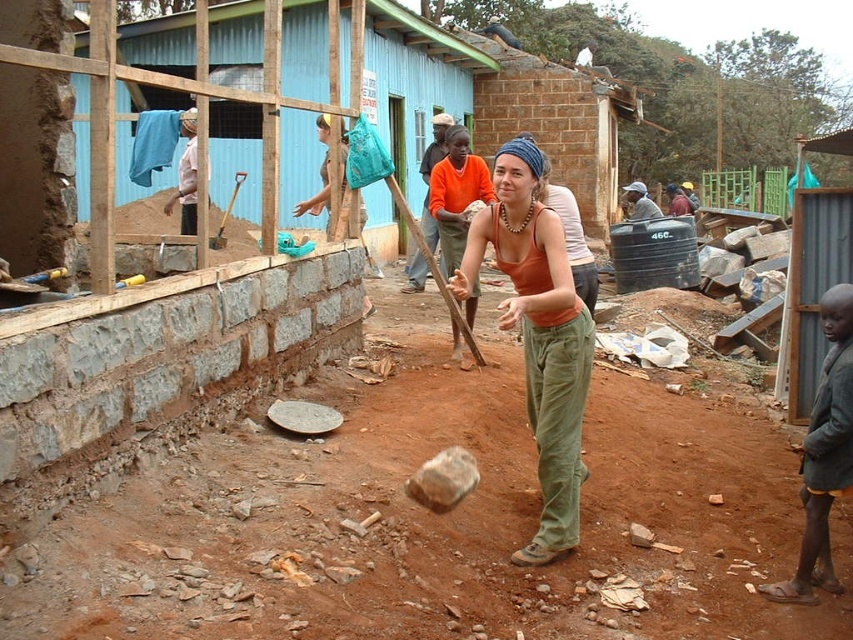
Based on the photo, you are a construction worker standing on the dark brown leather shoes at lower right. You need to move to the brown dirt field at center to start digging. Which direction should you move to reach it?

The brown dirt field at center is to the left of dark brown leather shoes at lower right, so you should move to your left to reach it.